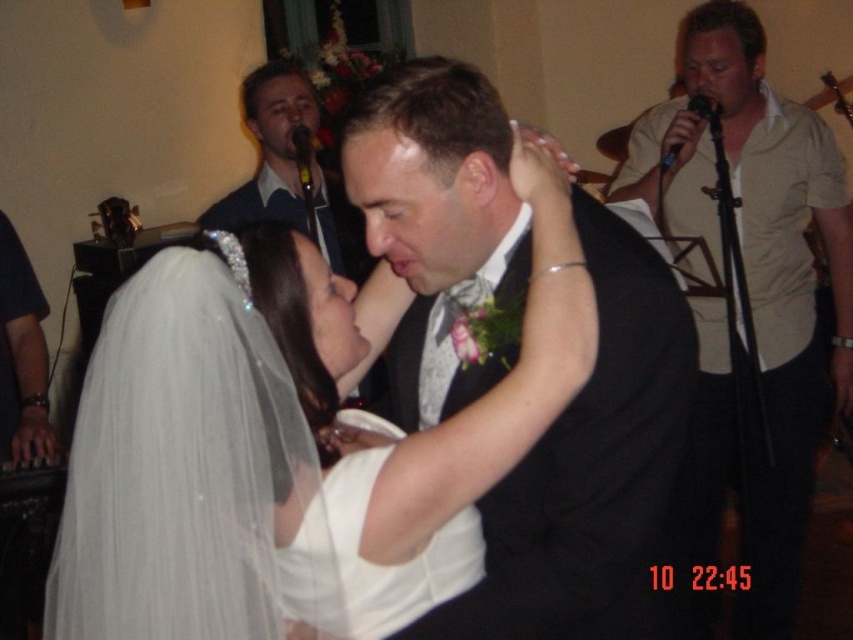
Based on the photo, you are a photographer at the wedding reception. You want to capture a photo of the couple where both the white satin dress at center and the matte black suit at upper center are visible. Given their sizes, which one should you frame first to ensure both fit in the shot?

The white satin dress at center is narrower than the matte black suit at upper center. To ensure both fit in the shot, frame the wider matte black suit at upper center first, then adjust the camera angle to include the narrower white satin dress at center.

You are a photographer at the wedding reception and want to take a photo of the beige shirt at upper right and the white satin dress at center. Which one should you focus on first to ensure both are in clear view?

The beige shirt at upper right is closer to you than the white satin dress at center, so you should focus on the beige shirt at upper right first to ensure both are in clear view.